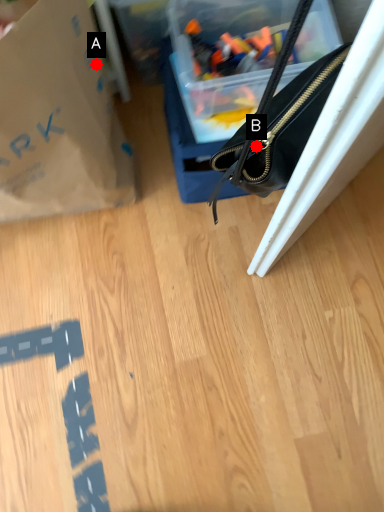
Question: Two points are circled on the image, labeled by A and B beside each circle. Among these points, which one is farthest from the camera?

Choices:
 (A) A is further
 (B) B is further

Answer: (A)